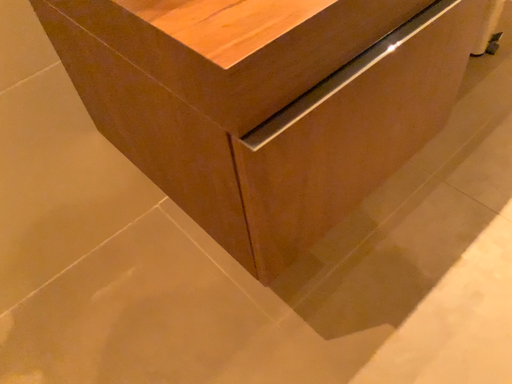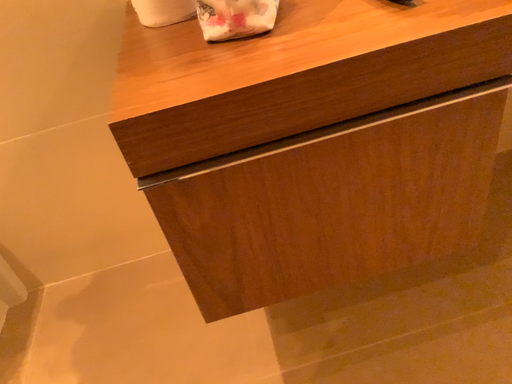
Question: How did the camera likely rotate when shooting the video?

Choices:
 (A) rotated left
 (B) rotated right

Answer: (A)